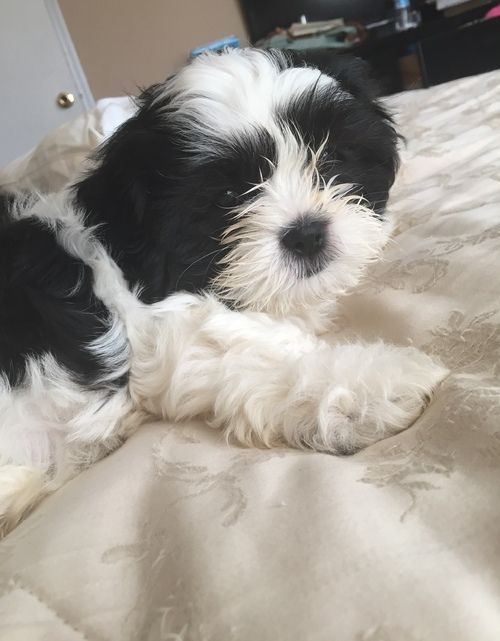
Locate an element on the screen. The width and height of the screenshot is (500, 641). wall is located at coordinates (133, 56).